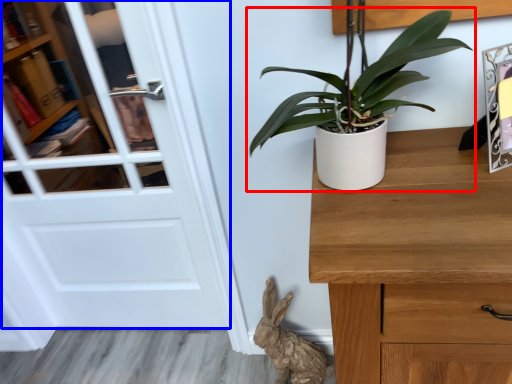
Question: Which object appears closest to the camera in this image, houseplant (highlighted by a red box) or door (highlighted by a blue box)?

Choices:
 (A) houseplant
 (B) door

Answer: (A)